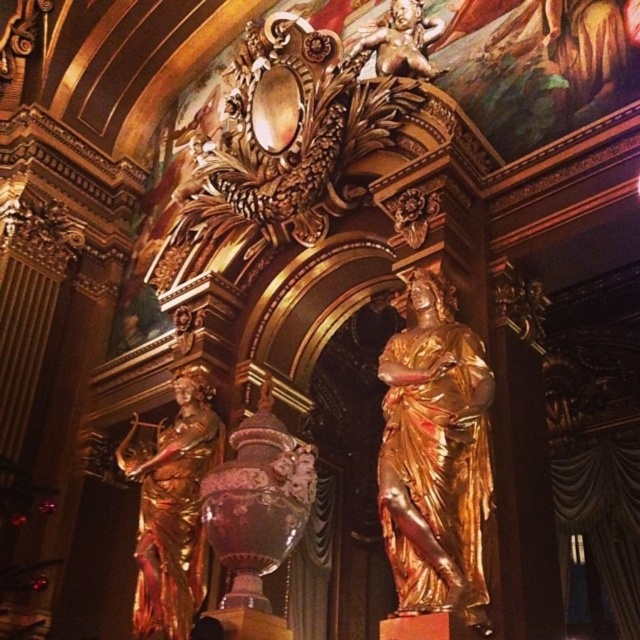
Question: Is gold polished statue at left wider than gold metallic cherub at upper center?

Choices:
 (A) no
 (B) yes

Answer: (B)

Question: Is gold polished statue at center to the left of gold metallic cherub at upper center from the viewer's perspective?

Choices:
 (A) yes
 (B) no

Answer: (A)

Question: Which point is closer to the camera?

Choices:
 (A) (483, 474)
 (B) (196, 470)
 (C) (401, 49)

Answer: (A)

Question: Which is farther from the gold polished statue at center?

Choices:
 (A) gold metallic cherub at upper center
 (B) gold polished statue at left

Answer: (A)

Question: Which of the following is the farthest from the observer?

Choices:
 (A) gold polished statue at center
 (B) gold polished statue at left

Answer: (B)

Question: Is gold polished statue at center behind gold polished statue at left?

Choices:
 (A) no
 (B) yes

Answer: (A)